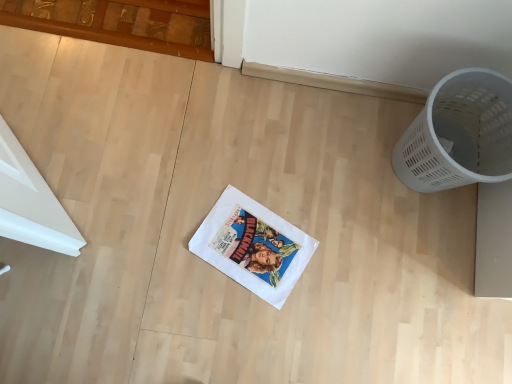
The height and width of the screenshot is (384, 512). In order to click on vacant space underneath white plastic basket at right (from a real-world perspective) in this screenshot , I will do `click(430, 192)`.